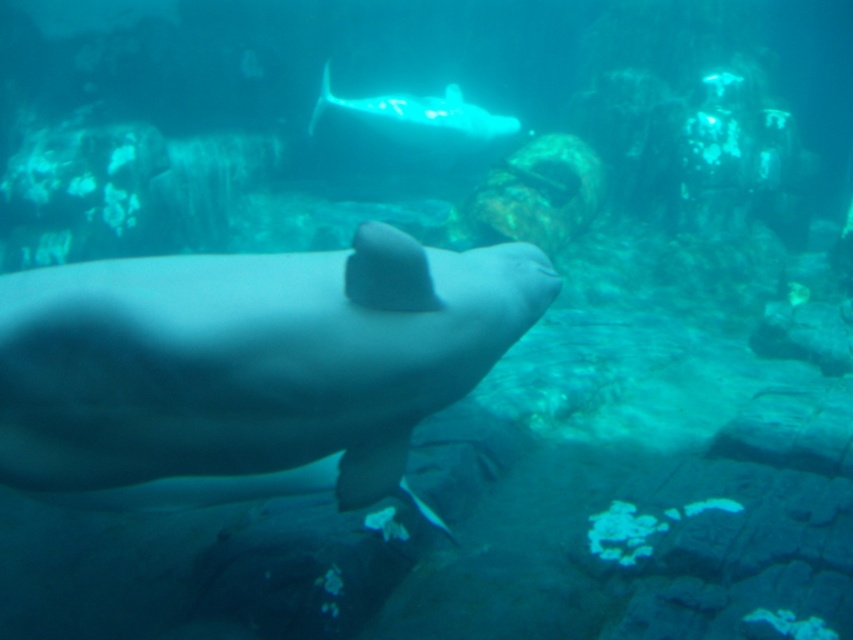
You are a marine biologist observing the two beluga whales in the underwater scene. Which beluga whale is closer to you, the smooth gray whale at center or the translucent white whale at center?

The smooth gray whale at center is closer to you because it is positioned in front of the translucent white whale at center.

You are a marine biologist planning to place a 5 meter long observation platform between the smooth gray whale at center and the translucent white whale at center. Will the platform fit between them without overlapping either whale?

→ The distance between the smooth gray whale at center and the translucent white whale at center is 7.86 meters. Since the platform is 5 meters long, it will fit between them without overlapping either whale.